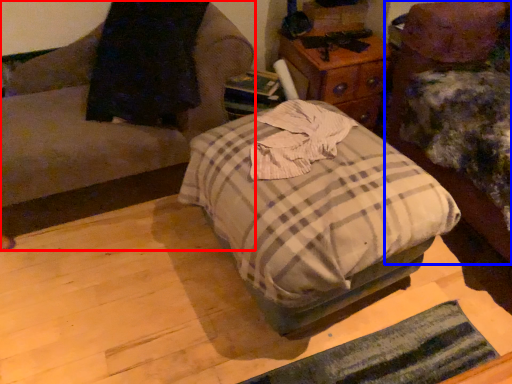
Question: Which point is closer to the camera, furniture (highlighted by a red box) or furniture (highlighted by a blue box)?

Choices:
 (A) furniture
 (B) furniture

Answer: (B)